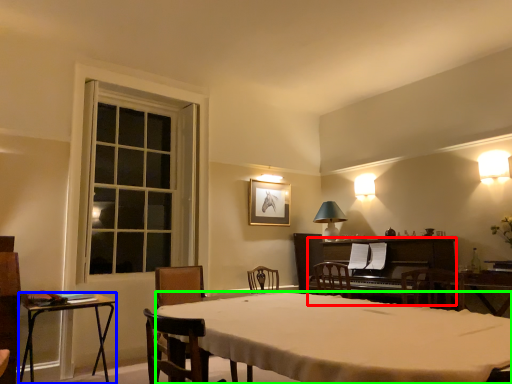
Question: Based on their relative distances, which object is farther from piano (highlighted by a red box)? Choose from table (highlighted by a blue box) and desk (highlighted by a green box).

Choices:
 (A) table
 (B) desk

Answer: (A)